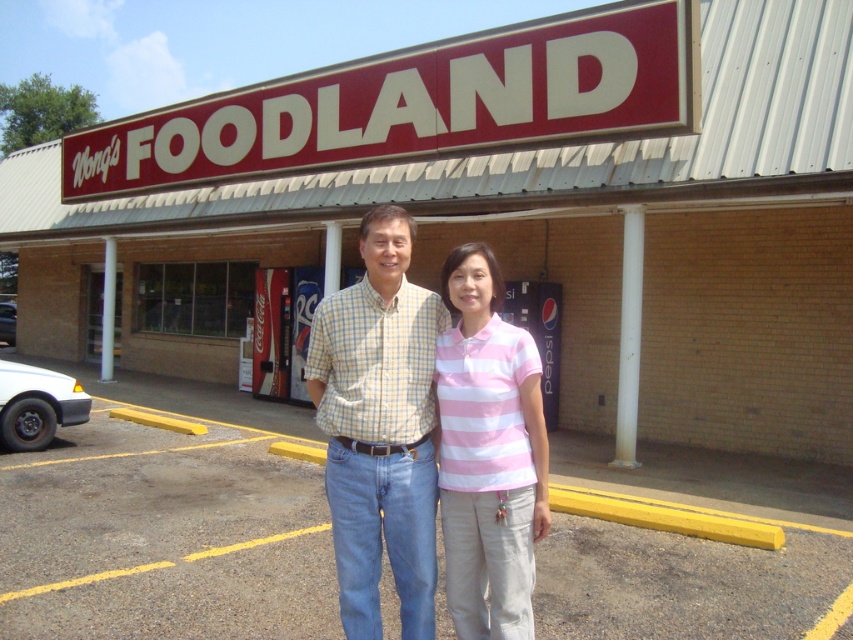
Between red plastic sign at upper center and checkered cotton shirt at center, which one appears on the right side from the viewer's perspective?

A: checkered cotton shirt at center

Is point (686, 65) in front of point (328, 403)?

No, (686, 65) is further to viewer.

Does point (560, 92) come farther from viewer compared to point (386, 250)?

That is True.

Identify the location of red plastic sign at upper center. The image size is (853, 640). (415, 106).

Can you confirm if red plastic sign at upper center is shorter than pink striped shirt at center?

Incorrect, red plastic sign at upper center's height does not fall short of pink striped shirt at center's.

Is point (135, 168) positioned behind point (494, 364)?

Yes.

Where is `red plastic sign at upper center`? This screenshot has height=640, width=853. red plastic sign at upper center is located at coordinates (415, 106).

Identify the location of red plastic sign at upper center. (415, 106).

Can you confirm if white brick building at center is bigger than red plastic sign at upper center?

Yes, white brick building at center is bigger than red plastic sign at upper center.

Does white brick building at center have a lesser width compared to red plastic sign at upper center?

In fact, white brick building at center might be wider than red plastic sign at upper center.

Describe the element at coordinates (543, 248) in the screenshot. I see `white brick building at center` at that location.

Identify the location of white brick building at center. (543, 248).